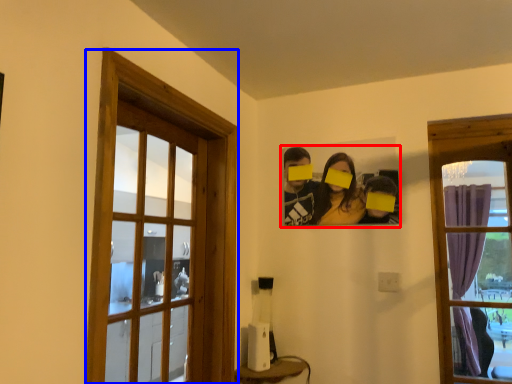
Question: Which object is closer to the camera taking this photo, couple (highlighted by a red box) or window (highlighted by a blue box)?

Choices:
 (A) couple
 (B) window

Answer: (B)